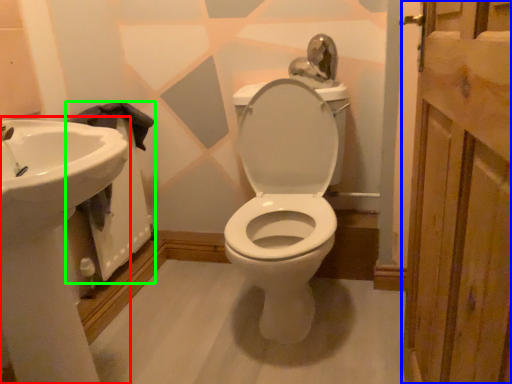
Question: Which is farther away from sink (highlighted by a red box)? screen door (highlighted by a blue box) or bath (highlighted by a green box)?

Choices:
 (A) screen door
 (B) bath

Answer: (A)